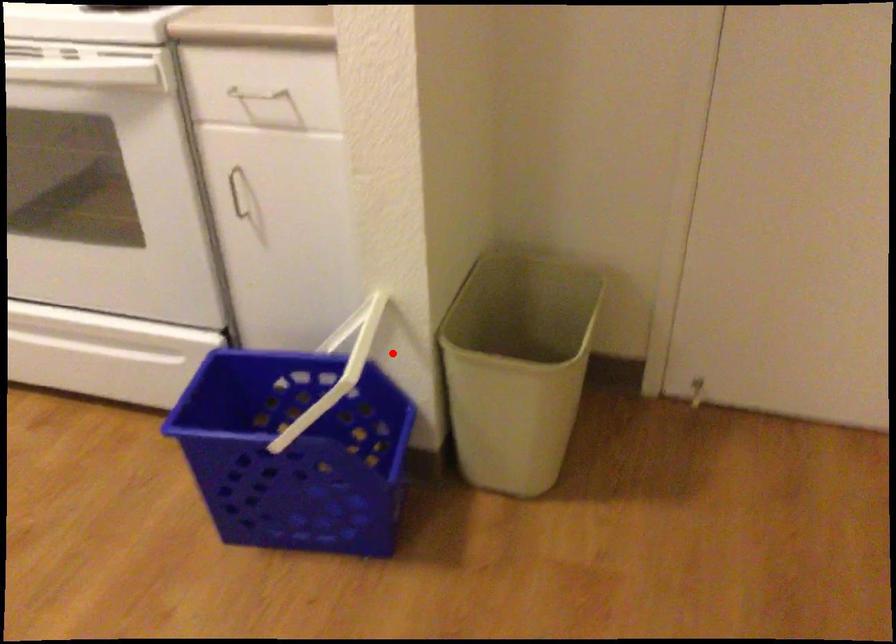
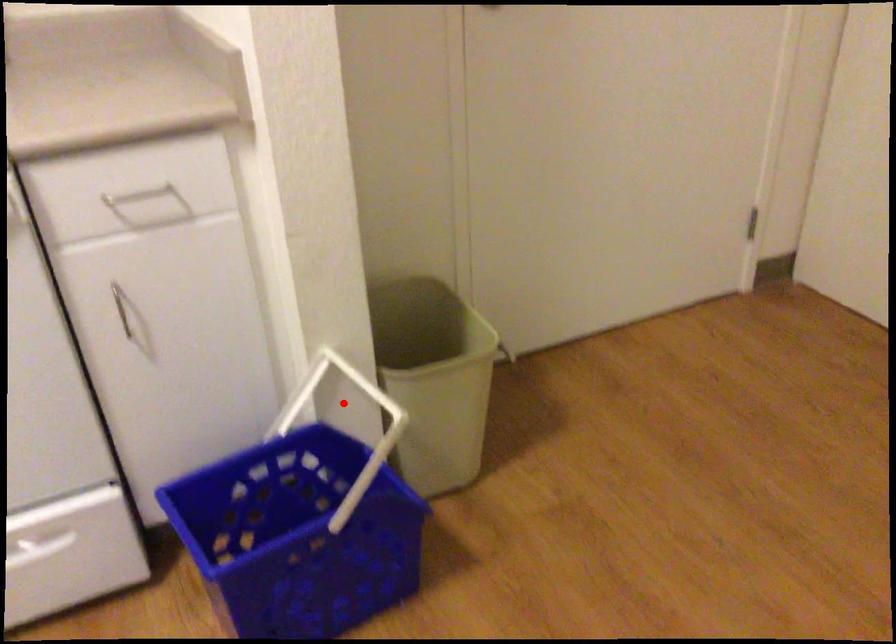
I am providing you with two images of the same scene from different viewpoints. A red point is marked on the first image and another point is marked on the second image. Does the point marked in image1 correspond to the same location as the one in image2?

Yes